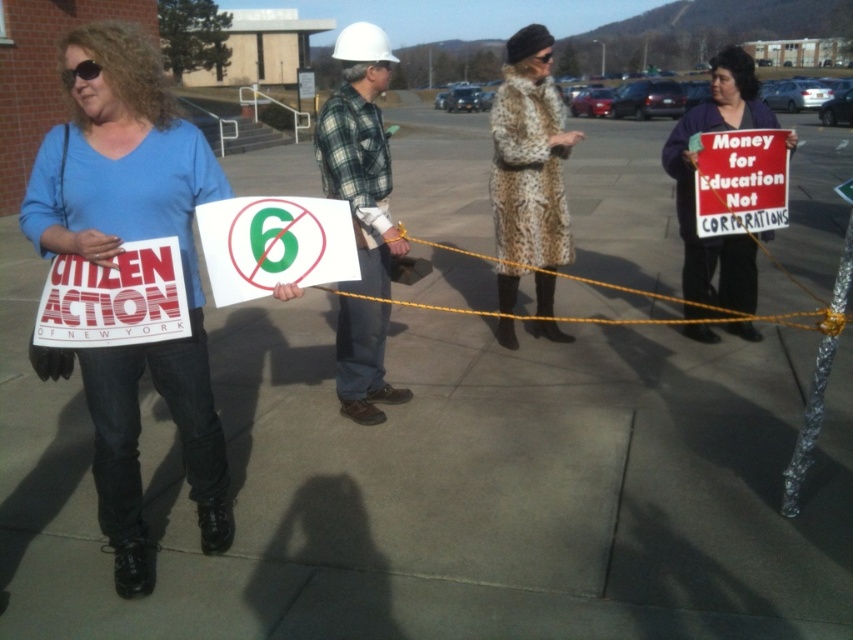
Question: In this image, where is white paper sign at center located relative to red cardboard sign at center?

Choices:
 (A) below
 (B) above

Answer: (A)

Question: Does plaid flannel shirt at center appear under red cardboard sign at center?

Choices:
 (A) no
 (B) yes

Answer: (A)

Question: Among these objects, which one is farthest from the camera?

Choices:
 (A) leopard print coat at center
 (B) red cardboard sign at center
 (C) plaid flannel shirt at center

Answer: (A)

Question: Is plaid flannel shirt at center smaller than white paper sign at center?

Choices:
 (A) yes
 (B) no

Answer: (A)

Question: Which of the following is the farthest from the observer?

Choices:
 (A) (746, 93)
 (B) (352, 172)

Answer: (A)

Question: Among these points, which one is farthest from the camera?

Choices:
 (A) (717, 214)
 (B) (570, 250)
 (C) (218, 218)
 (D) (167, 253)

Answer: (B)